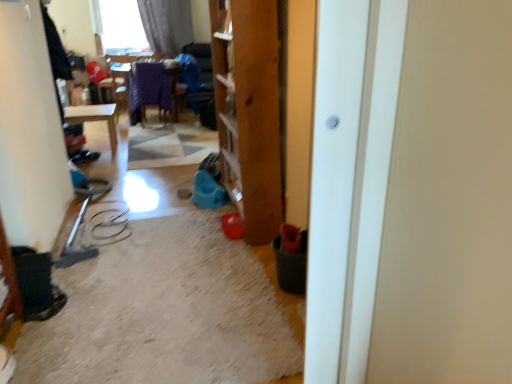
Question: In the image, is white glossy door at center positioned in front of or behind matte gray curtain at upper left?

Choices:
 (A) behind
 (B) front

Answer: (B)

Question: Considering the relative positions of white glossy door at center and matte gray curtain at upper left in the image provided, is white glossy door at center to the left or to the right of matte gray curtain at upper left?

Choices:
 (A) left
 (B) right

Answer: (B)

Question: From a real-world perspective, is white glossy door at center above or below matte gray curtain at upper left?

Choices:
 (A) below
 (B) above

Answer: (A)

Question: Based on their positions, is matte gray curtain at upper left located to the left or right of white glossy door at center?

Choices:
 (A) right
 (B) left

Answer: (B)

Question: Looking at the image, does matte gray curtain at upper left seem bigger or smaller compared to white glossy door at center?

Choices:
 (A) small
 (B) big

Answer: (B)

Question: From the image's perspective, relative to white glossy door at center, is matte gray curtain at upper left above or below?

Choices:
 (A) below
 (B) above

Answer: (B)

Question: From their relative heights in the image, would you say matte gray curtain at upper left is taller or shorter than white glossy door at center?

Choices:
 (A) tall
 (B) short

Answer: (B)